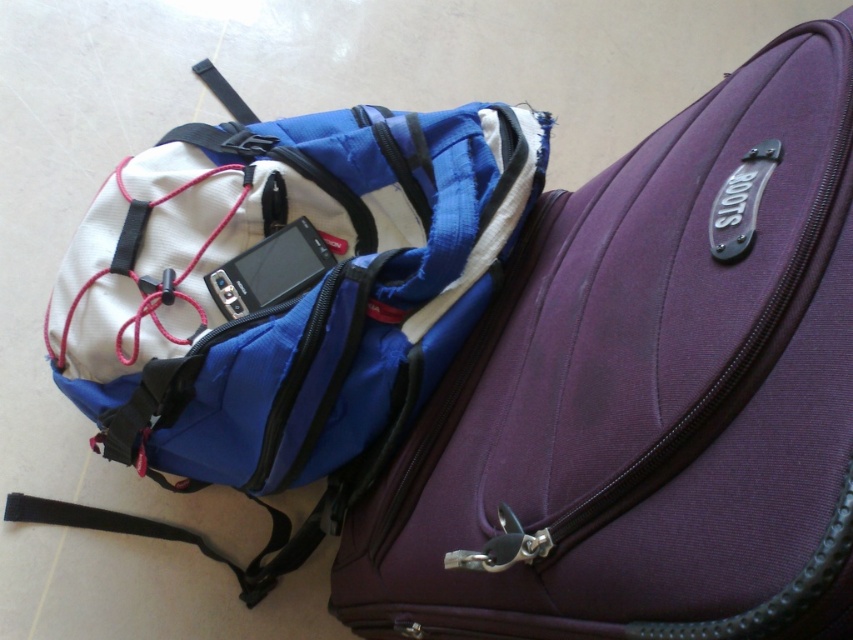
Question: From the image, what is the correct spatial relationship of blue fabric backpack at upper left in relation to satin black smartphone at center?

Choices:
 (A) left
 (B) right

Answer: (A)

Question: Estimate the real-world distances between objects in this image. Which object is closer to the blue fabric backpack at upper left?

Choices:
 (A) satin black smartphone at center
 (B) purple fabric suitcase at center

Answer: (A)

Question: Which point appears farthest from the camera in this image?

Choices:
 (A) (521, 480)
 (B) (258, 176)
 (C) (277, 234)

Answer: (C)

Question: Which object appears farthest from the camera in this image?

Choices:
 (A) purple fabric suitcase at center
 (B) blue fabric backpack at upper left

Answer: (B)

Question: Does purple fabric suitcase at center have a lesser width compared to blue fabric backpack at upper left?

Choices:
 (A) no
 (B) yes

Answer: (B)

Question: Is the position of blue fabric backpack at upper left more distant than that of satin black smartphone at center?

Choices:
 (A) no
 (B) yes

Answer: (A)